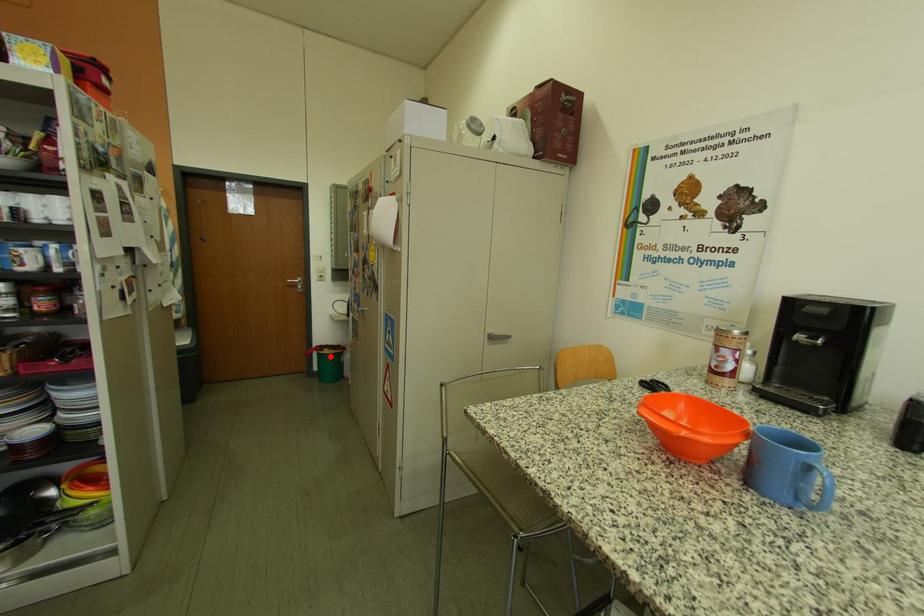
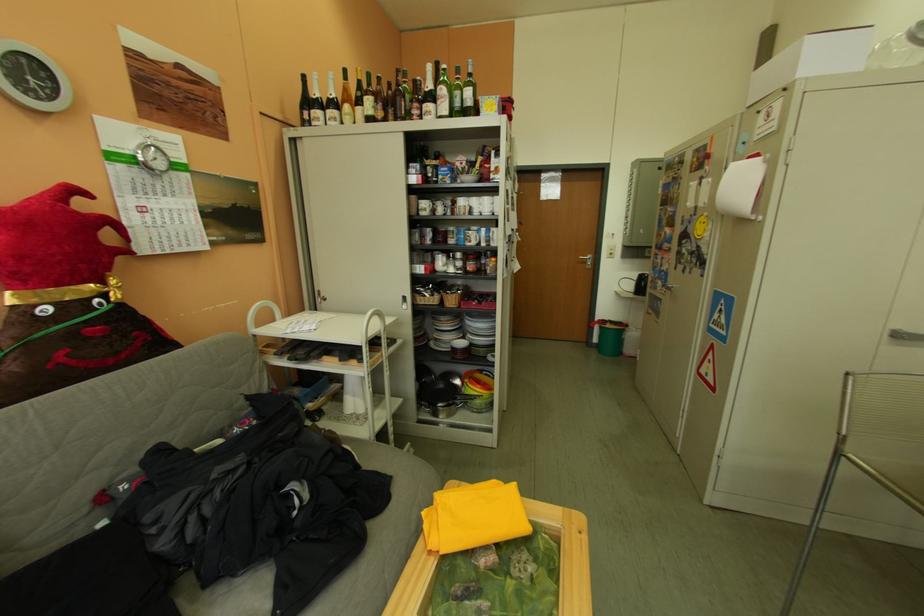
In the second image, find the point that corresponds to the highlighted location in the first image.

(613, 330)